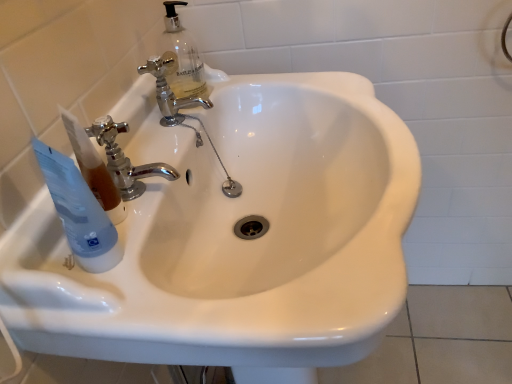
Question: Can you confirm if white glossy sink at center is bigger than chrome metallic faucet at upper left, the second tap positioned from the top?

Choices:
 (A) yes
 (B) no

Answer: (A)

Question: Considering the relative positions of white glossy sink at center and chrome metallic faucet at upper left, arranged as the second tap when viewed from the back, in the image provided, is white glossy sink at center to the right of chrome metallic faucet at upper left, arranged as the second tap when viewed from the back, from the viewer's perspective?

Choices:
 (A) yes
 (B) no

Answer: (A)

Question: Can we say white glossy sink at center lies outside chrome metallic faucet at upper left, arranged as the second tap when viewed from the back?

Choices:
 (A) yes
 (B) no

Answer: (A)

Question: Does white glossy sink at center lie in front of chrome metallic faucet at upper left, which is the 1th tap from bottom to top?

Choices:
 (A) yes
 (B) no

Answer: (A)

Question: Is chrome metallic faucet at upper left, arranged as the second tap when viewed from the back, at the back of white glossy sink at center?

Choices:
 (A) no
 (B) yes

Answer: (A)

Question: Is white glossy sink at center positioned far away from chrome metallic faucet at upper left, arranged as the second tap when viewed from the back?

Choices:
 (A) no
 (B) yes

Answer: (A)

Question: Are transparent plastic tube at left and chrome metallic faucet at upper left, arranged as the 1th tap when viewed from the front, making contact?

Choices:
 (A) yes
 (B) no

Answer: (B)

Question: Considering the relative positions of transparent plastic tube at left and chrome metallic faucet at upper left, the second tap positioned from the top, in the image provided, is transparent plastic tube at left to the right of chrome metallic faucet at upper left, the second tap positioned from the top, from the viewer's perspective?

Choices:
 (A) no
 (B) yes

Answer: (A)

Question: Considering the relative positions of transparent plastic tube at left and chrome metallic faucet at upper left, which is the 1th tap from bottom to top, in the image provided, is transparent plastic tube at left to the left of chrome metallic faucet at upper left, which is the 1th tap from bottom to top, from the viewer's perspective?

Choices:
 (A) yes
 (B) no

Answer: (A)

Question: Can you confirm if transparent plastic tube at left is shorter than chrome metallic faucet at upper left, arranged as the 1th tap when viewed from the front?

Choices:
 (A) yes
 (B) no

Answer: (B)

Question: Would you say transparent plastic tube at left contains chrome metallic faucet at upper left, which is the 1th tap from bottom to top?

Choices:
 (A) yes
 (B) no

Answer: (B)

Question: Does transparent plastic tube at left have a smaller size compared to chrome metallic faucet at upper left, which is the 1th tap from bottom to top?

Choices:
 (A) yes
 (B) no

Answer: (B)

Question: Can you confirm if chrome metallic faucet at center, the 2th tap from the front, is positioned to the right of white glossy sink at center?

Choices:
 (A) no
 (B) yes

Answer: (A)